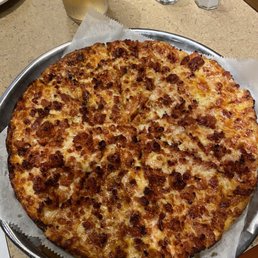
This screenshot has width=258, height=258. I want to click on metal pan, so click(x=23, y=248).